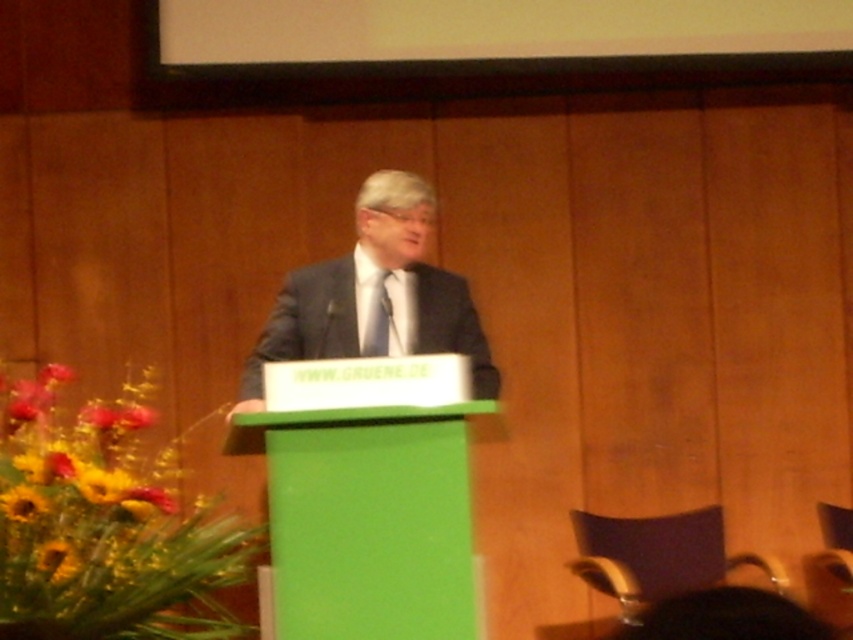
Question: Can you confirm if dark gray suit at center is positioned to the right of yellow sunflower at lower left?

Choices:
 (A) yes
 (B) no

Answer: (A)

Question: Can you confirm if blue silk tie at center is wider than yellow sunflower at lower left?

Choices:
 (A) no
 (B) yes

Answer: (A)

Question: Estimate the real-world distances between objects in this image. Which object is farther from the blue silk tie at center?

Choices:
 (A) yellow sunflower at lower left
 (B) dark gray suit at center

Answer: (A)

Question: Does dark gray suit at center have a larger size compared to yellow sunflower at lower left?

Choices:
 (A) no
 (B) yes

Answer: (B)

Question: Which point appears farthest from the camera in this image?

Choices:
 (A) (375, 176)
 (B) (381, 305)
 (C) (33, 513)

Answer: (A)

Question: Estimate the real-world distances between objects in this image. Which object is closer to the dark gray suit at center?

Choices:
 (A) yellow sunflower at lower left
 (B) blue silk tie at center

Answer: (B)